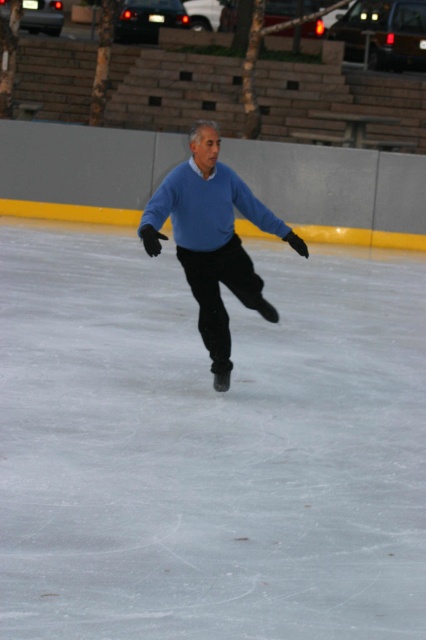
You are standing at the edge of the ice skating rink and see the white smooth ice at center and the matte blue sweater at center. Which object is closer to you?

The white smooth ice at center is closer to the viewer than the matte blue sweater at center.

You are standing at the edge of the ice skating rink and notice the white smooth ice at center and the matte blue sweater at center. Which object is higher from the ground?

The white smooth ice at center is higher than the matte blue sweater at center because the ice is the surface on which the person wearing the sweater is skating, so the sweater is lower in height compared to the ice.